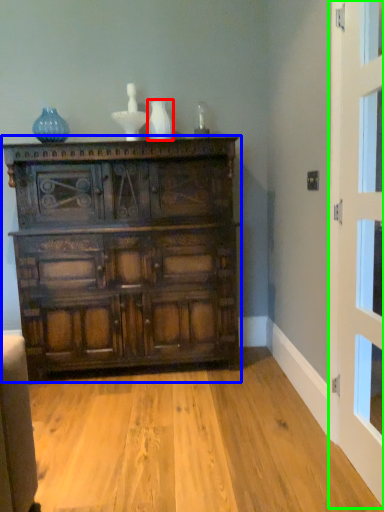
Question: Which object is the farthest from vase (highlighted by a red box)? Choose among these: chest of drawers (highlighted by a blue box) or door (highlighted by a green box).

Choices:
 (A) chest of drawers
 (B) door

Answer: (B)